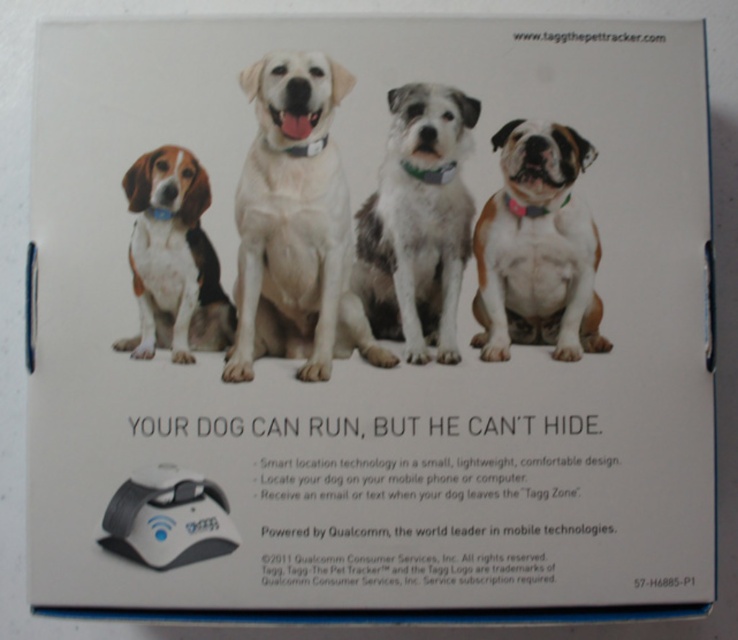
Based on the scene description, where is the white matte dog at center positioned in relation to the other dogs?

The white matte dog at center is located at point (294, 225), which is the central position among the four dogs arranged side by side.

You are looking at the promotional material for the Tagg pet tracking device. There are two dogs featured here, a white matte dog at center and a pink fabric dog at right. Which one is more to the left?

The white matte dog at center is more to the left than the pink fabric dog at right.